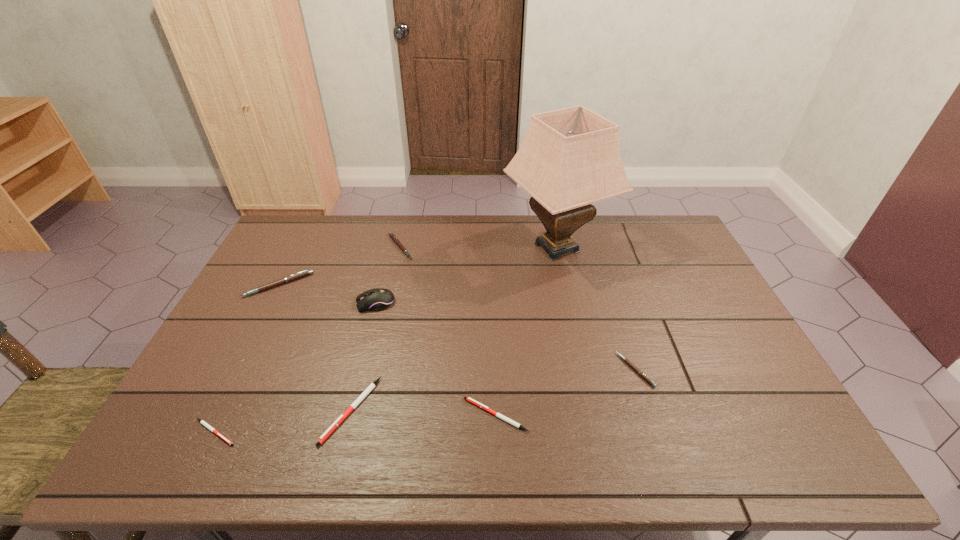
At what (x,y) coordinates should I click in order to perform the action: click on lampshade. Please return your answer as a coordinate pair (x, y). The width and height of the screenshot is (960, 540). Looking at the image, I should click on (570, 158).

Locate an element on the screen. the tallest object is located at coordinates (570, 158).

The height and width of the screenshot is (540, 960). What are the coordinates of `the second tallest object` in the screenshot? It's located at (377, 299).

The image size is (960, 540). In order to click on computer mouse in this screenshot , I will do `click(377, 299)`.

Image resolution: width=960 pixels, height=540 pixels. Identify the location of the tallest pen. (304, 273).

The image size is (960, 540). In order to click on the second nearest pink pen in this screenshot , I will do `click(304, 273)`.

The image size is (960, 540). Identify the location of the second pink pen from right to left. (391, 234).

This screenshot has width=960, height=540. I want to click on the farthest pink pen, so click(391, 234).

The image size is (960, 540). I want to click on the biggest white pen, so click(x=325, y=435).

Locate an element on the screen. The height and width of the screenshot is (540, 960). the rightmost pen is located at coordinates (644, 376).